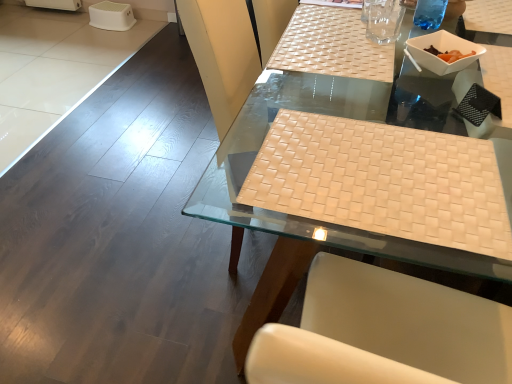
Question: Can you confirm if white woven placemat at center is shorter than transparent plastic cup at upper right?

Choices:
 (A) no
 (B) yes

Answer: (A)

Question: Is white woven placemat at center completely or partially outside of transparent plastic cup at upper right?

Choices:
 (A) yes
 (B) no

Answer: (A)

Question: Does white woven placemat at center have a greater height compared to transparent plastic cup at upper right?

Choices:
 (A) no
 (B) yes

Answer: (B)

Question: Is white woven placemat at center positioned behind transparent plastic cup at upper right?

Choices:
 (A) yes
 (B) no

Answer: (B)

Question: Is white woven placemat at center smaller than transparent plastic cup at upper right?

Choices:
 (A) no
 (B) yes

Answer: (A)

Question: From the image's perspective, would you say white woven placemat at center is positioned over transparent plastic cup at upper right?

Choices:
 (A) no
 (B) yes

Answer: (A)

Question: Is white woven placemat at center placed right next to beige woven mat at center?

Choices:
 (A) yes
 (B) no

Answer: (B)

Question: From a real-world perspective, is white woven placemat at center on beige woven mat at center?

Choices:
 (A) no
 (B) yes

Answer: (A)

Question: Considering the relative sizes of white woven placemat at center and beige woven mat at center in the image provided, is white woven placemat at center bigger than beige woven mat at center?

Choices:
 (A) no
 (B) yes

Answer: (B)

Question: From the image's perspective, is white woven placemat at center on beige woven mat at center?

Choices:
 (A) yes
 (B) no

Answer: (A)

Question: Could you tell me if white woven placemat at center is facing beige woven mat at center?

Choices:
 (A) yes
 (B) no

Answer: (B)

Question: Is white woven placemat at center facing away from beige woven mat at center?

Choices:
 (A) no
 (B) yes

Answer: (A)

Question: From a real-world perspective, is white plastic bowl at upper right physically above white woven placemat at center?

Choices:
 (A) no
 (B) yes

Answer: (B)